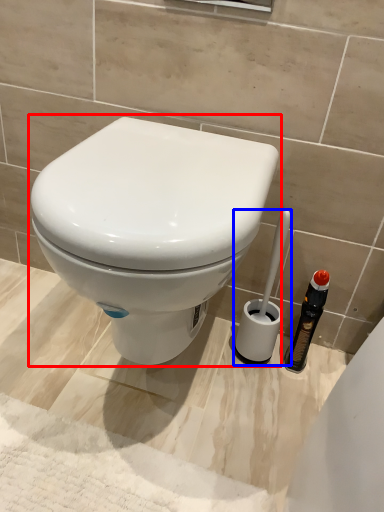
Question: Among these objects, which one is farthest to the camera, toilet (highlighted by a red box) or brush (highlighted by a blue box)?

Choices:
 (A) toilet
 (B) brush

Answer: (B)